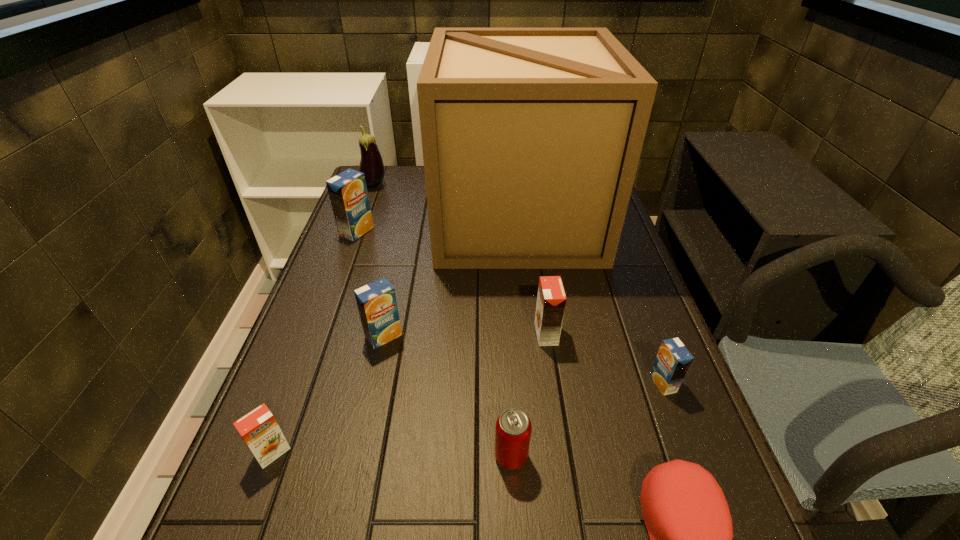
In the image, there is a desktop. Identify the location of vacant space at the left edge. (391, 226).

Image resolution: width=960 pixels, height=540 pixels. In order to click on vacant space at the right edge of the desktop in this screenshot , I will do `click(600, 279)`.

Where is `free point between the rightmost blue orange_juice and the farthest blue orange_juice`? free point between the rightmost blue orange_juice and the farthest blue orange_juice is located at coordinates (510, 307).

The width and height of the screenshot is (960, 540). Find the location of `free space between the biggest blue orange_juice and the nearer orange orange juice`. free space between the biggest blue orange_juice and the nearer orange orange juice is located at coordinates click(315, 342).

Locate an element on the screen. Image resolution: width=960 pixels, height=540 pixels. blank region between the eggplant and the can is located at coordinates (443, 321).

Locate an element on the screen. Image resolution: width=960 pixels, height=540 pixels. vacant point located between the can and the fourth orange juice from left to right is located at coordinates (529, 395).

Identify the location of free spot between the tallest object and the second nearest blue orange_juice. (450, 278).

Find the location of a particular element. free space between the nearer orange orange juice and the can is located at coordinates (392, 455).

Locate an element on the screen. Image resolution: width=960 pixels, height=540 pixels. blank region between the box and the second smallest blue orange_juice is located at coordinates 450,278.

The height and width of the screenshot is (540, 960). What are the coordinates of `unoccupied position between the left orange orange juice and the rightmost orange juice` in the screenshot? It's located at (468, 418).